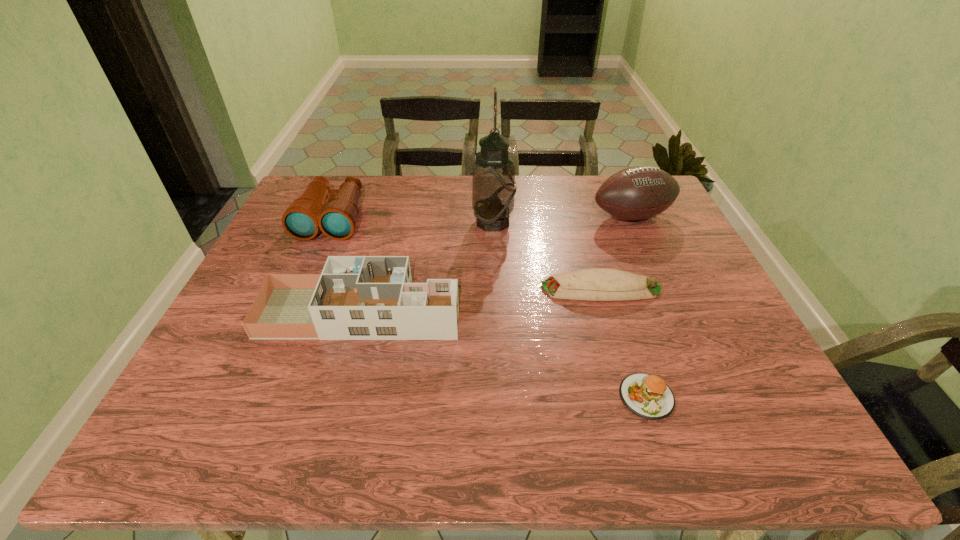
Locate which object is the second closest to the second tallest object. Please provide its 2D coordinates. Your answer should be formatted as a tuple, i.e. [(x, y)], where the tuple contains the x and y coordinates of a point satisfying the conditions above.

[(493, 182)]

The height and width of the screenshot is (540, 960). Identify the location of free space that satisfies the following two spatial constraints: 1. at the bitten end of the burrito; 2. on the left side of the nearest object. (633, 396).

Locate an element on the screen. This screenshot has height=540, width=960. blank area in the image that satisfies the following two spatial constraints: 1. through the lenses of the nearest object; 2. on the left side of the binoculars is located at coordinates (254, 396).